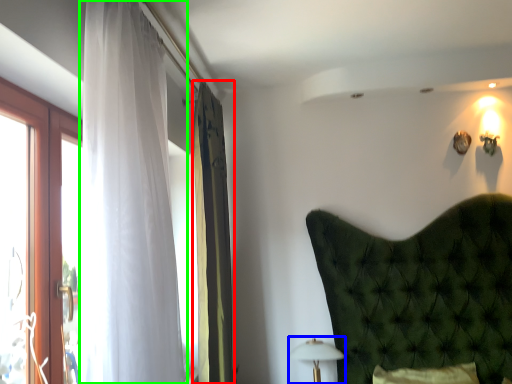
Question: Which is farther away from curtain (highlighted by a red box)? table lamp (highlighted by a blue box) or curtain (highlighted by a green box)?

Choices:
 (A) table lamp
 (B) curtain

Answer: (B)